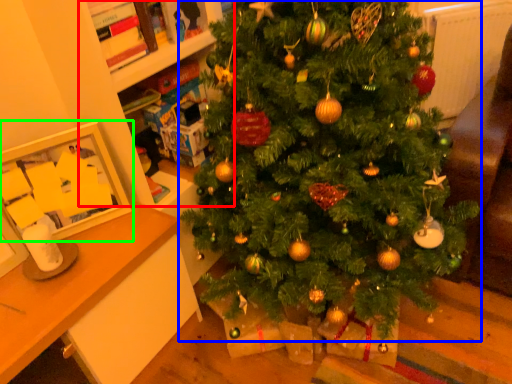
Question: Based on their relative distances, which object is nearer to bookshelf (highlighted by a red box)? Choose from christmas tree (highlighted by a blue box) and picture frame (highlighted by a green box).

Choices:
 (A) christmas tree
 (B) picture frame

Answer: (B)